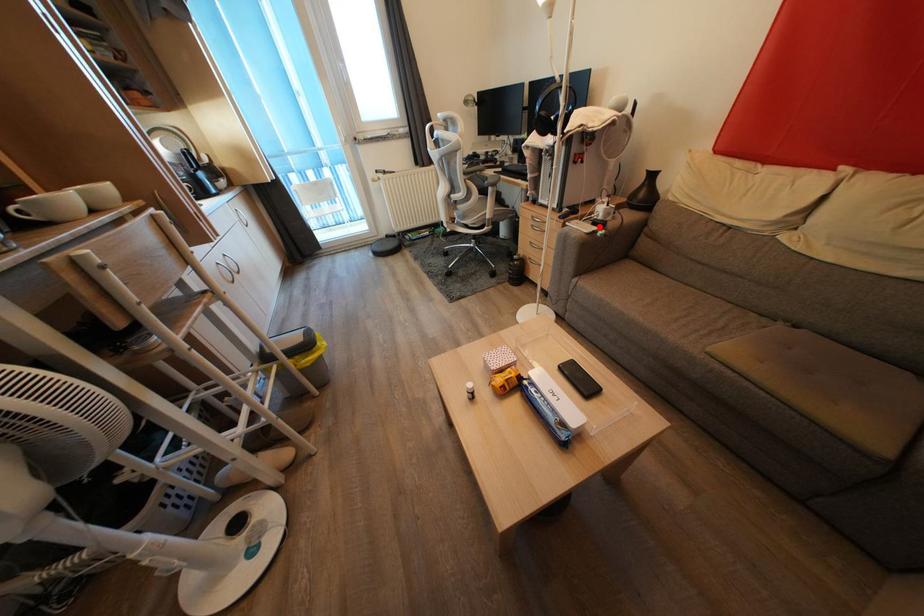
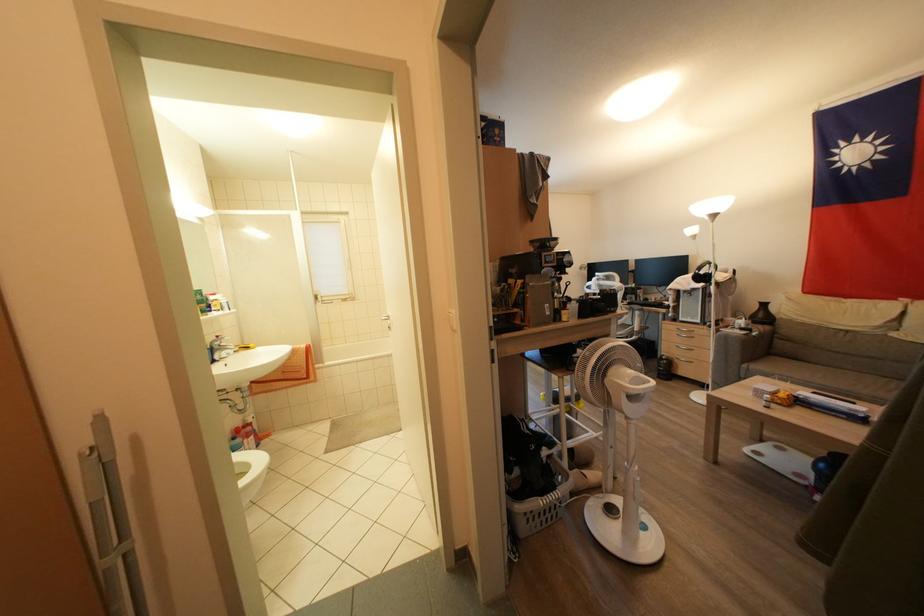
Question: I am providing you with two images of the same scene from different viewpoints. Image1 has a red point marked. In image2, the corresponding 3D location appears at what relative position? Reply with the corresponding letter.

Choices:
 (A) Closer
 (B) Farther

Answer: (B)